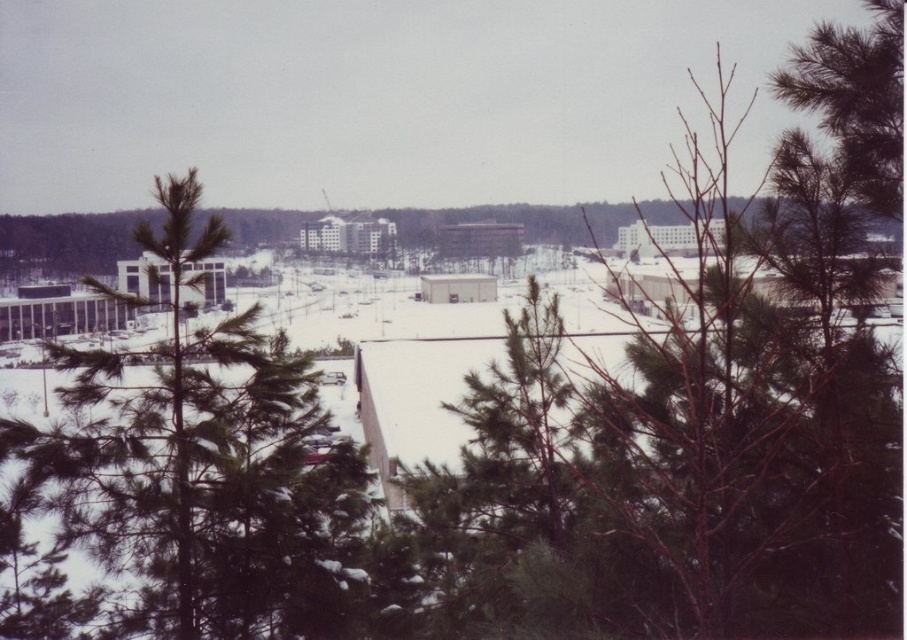
Is green leafy tree at center to the right of green needle-like tree at center from the viewer's perspective?

Yes, green leafy tree at center is to the right of green needle-like tree at center.

Does green leafy tree at center appear under green needle-like tree at center?

No, green leafy tree at center is not below green needle-like tree at center.

The height and width of the screenshot is (640, 907). Identify the location of green leafy tree at center. (689, 448).